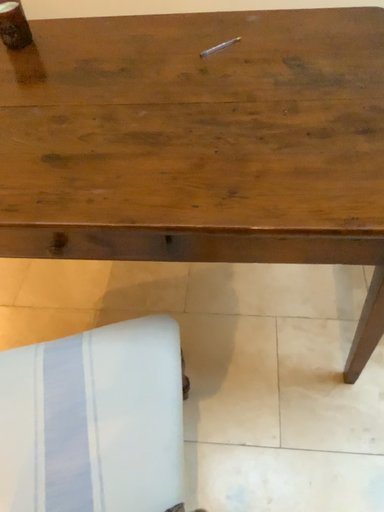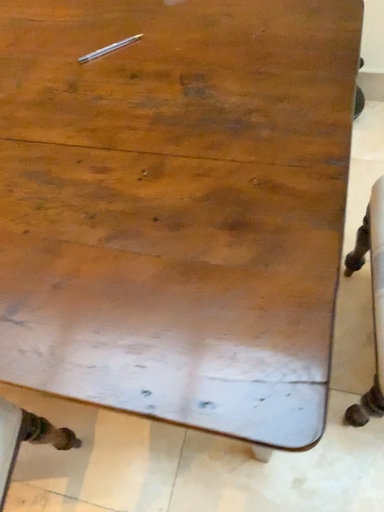
Question: Which way did the camera rotate in the video?

Choices:
 (A) rotated upward
 (B) rotated downward

Answer: (B)